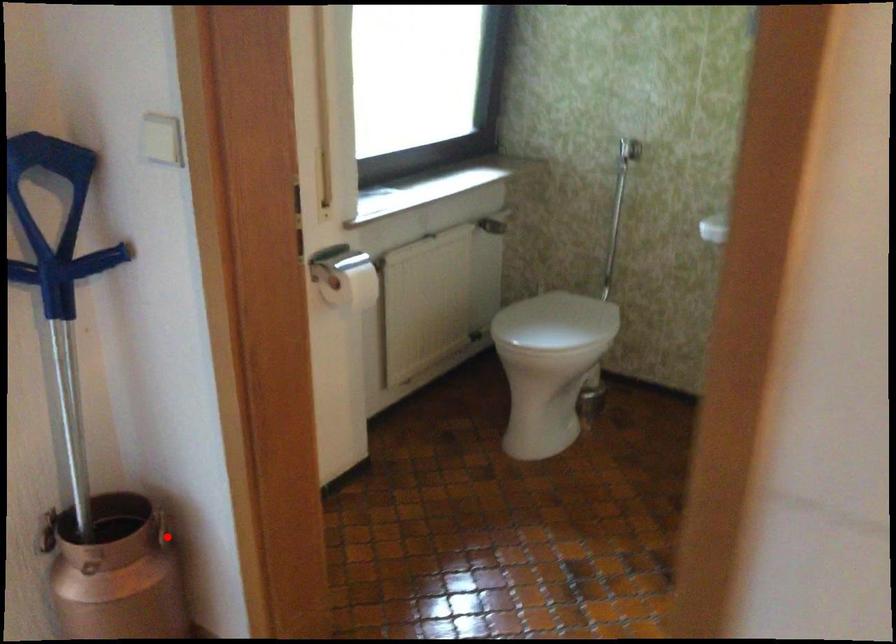
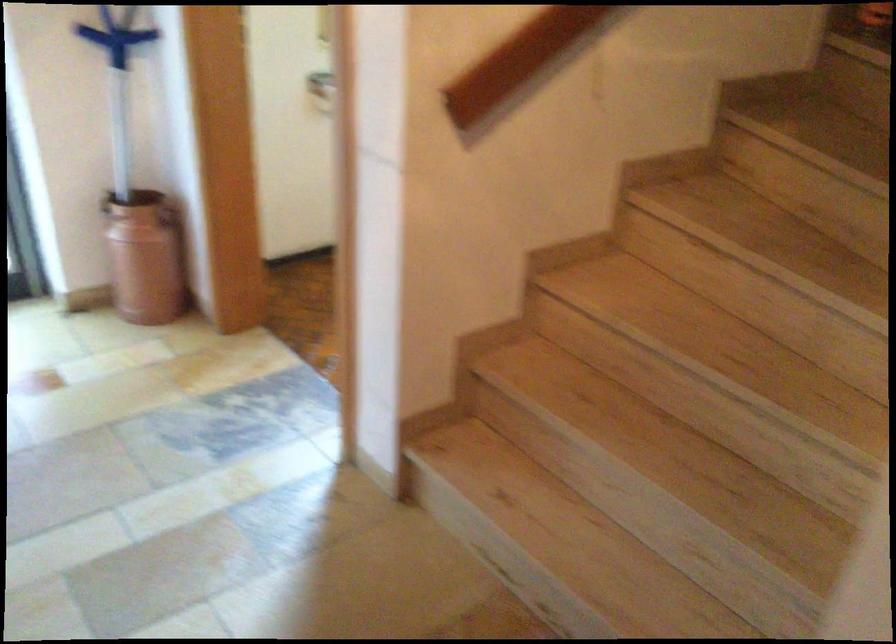
Where in the second image is the point corresponding to the highlighted location from the first image?

(168, 216)